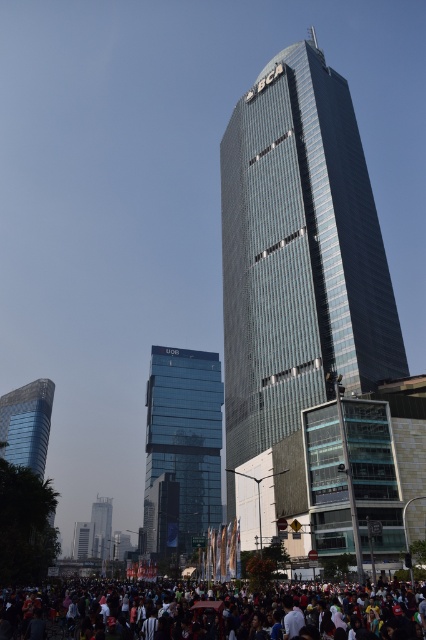
You are a city planner assessing the space between the shiny glass skyscraper at center and the multicolored fabric crowd at lower center. Based on their widths, which one takes up more horizontal space in the image?

The multicolored fabric crowd at lower center takes up more horizontal space since it has a greater width than the shiny glass skyscraper at center.

Based on the photo, you are standing at the entrance of the transparent glass building at center. If you look towards the direction of the crowd, which direction should you face?

Since the transparent glass building at center is located at point (181, 449), you should face towards the crowd which is in the foreground, likely to the front or lower part of the image from the building.